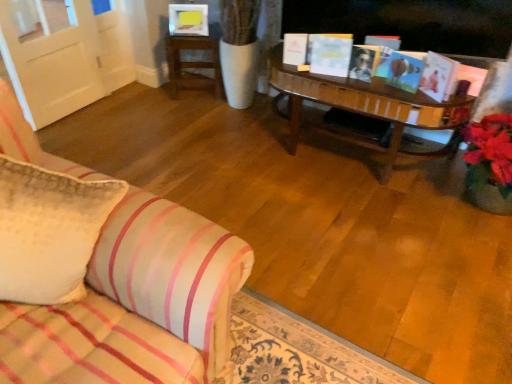
I want to click on free space to the left of wooden table at upper center, so click(146, 99).